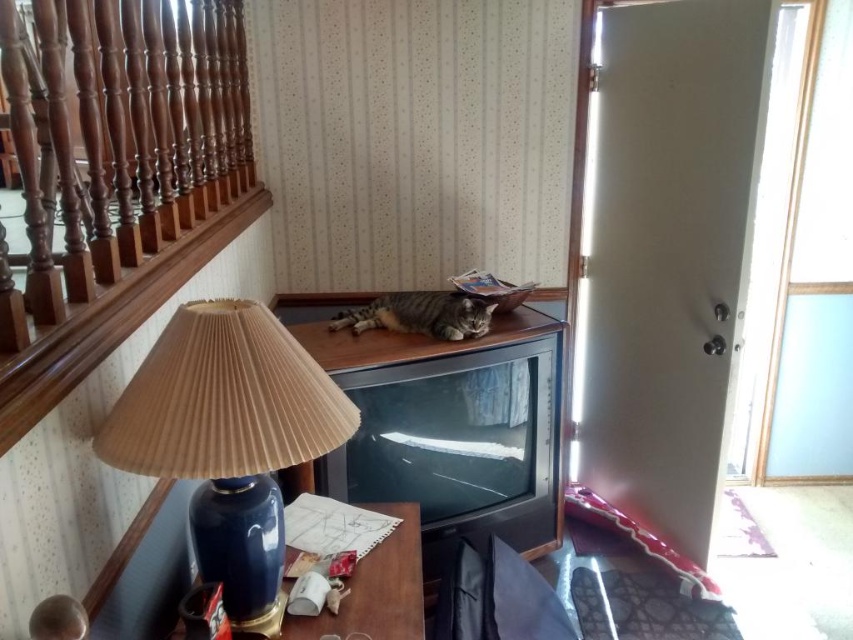
You are an interior designer planning to hang a picture frame exactly where the blue ceramic lampshade at upper left is currently located. What coordinates should you mark on your blueprint?

You should mark the coordinates at point (x=224, y=397) on your blueprint to place the picture frame where the blue ceramic lampshade at upper left is located.

You are standing in the room and want to reach the object located at point (196, 465). If your arm can extend 36 inches, can you comfortably reach it without moving your position?

The point (196, 465) is 38.64 inches away from the viewer, which is slightly beyond your arm reach of 36 inches. You might need to take a step forward or adjust your position to comfortably reach it.

You are standing in the room and want to place a new decorative item on the table. Where is the brown wood railing at upper left in relation to the table?

The brown wood railing at upper left is located at point [120,177], which is to the upper left of the table.